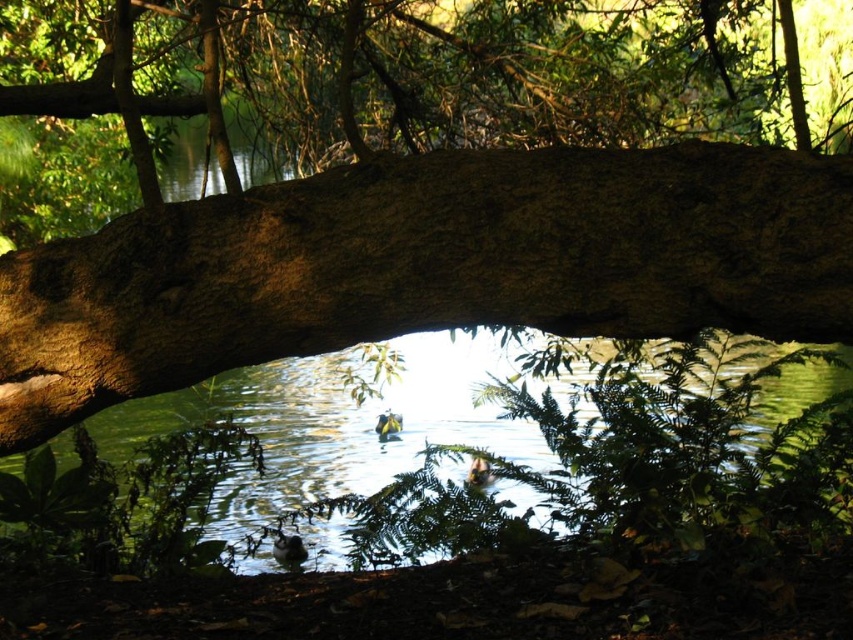
You are standing in the forest and looking through the brown rough tree trunk at center. Can you see the green liquid water at center clearly?

The brown rough tree trunk at center is in front of the green liquid water at center, so it might block your view of the water.

You are an artist trying to paint this scene. You want to ensure that the brown rough tree trunk at center and the green liquid water at center are proportionally accurate. Which object should you make larger in your painting?

The green liquid water at center should be made larger because it occupies more space than the brown rough tree trunk at center.